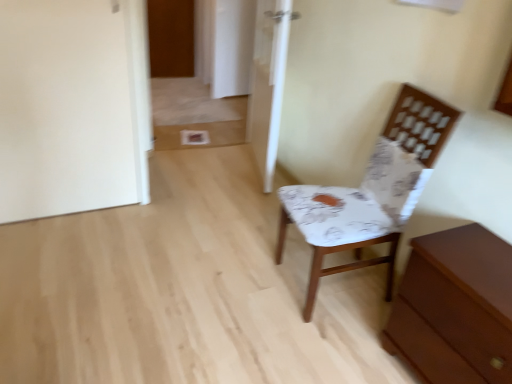
Question: Does white fabric chair at right touch brown wooden chest of drawers at lower right?

Choices:
 (A) no
 (B) yes

Answer: (A)

Question: Is white fabric chair at right smaller than brown wooden chest of drawers at lower right?

Choices:
 (A) yes
 (B) no

Answer: (B)

Question: From a real-world perspective, is white fabric chair at right positioned under brown wooden chest of drawers at lower right based on gravity?

Choices:
 (A) no
 (B) yes

Answer: (A)

Question: Does white fabric chair at right appear on the left side of brown wooden chest of drawers at lower right?

Choices:
 (A) no
 (B) yes

Answer: (B)

Question: From a real-world perspective, is white fabric chair at right on brown wooden chest of drawers at lower right?

Choices:
 (A) no
 (B) yes

Answer: (B)

Question: Considering the relative positions of white fabric chair at right and brown wooden chest of drawers at lower right in the image provided, is white fabric chair at right to the right of brown wooden chest of drawers at lower right from the viewer's perspective?

Choices:
 (A) yes
 (B) no

Answer: (B)

Question: Is wooden door at upper left, positioned as the second door in bottom-to-top order, surrounding white fabric chair at right?

Choices:
 (A) yes
 (B) no

Answer: (B)

Question: Is there a large distance between wooden door at upper left, which is counted as the 2th door, starting from the front, and white fabric chair at right?

Choices:
 (A) yes
 (B) no

Answer: (A)

Question: Is wooden door at upper left, which is counted as the 2th door, starting from the right, not within white fabric chair at right?

Choices:
 (A) yes
 (B) no

Answer: (A)

Question: From a real-world perspective, is wooden door at upper left, arranged as the first door when viewed from the back, below white fabric chair at right?

Choices:
 (A) no
 (B) yes

Answer: (B)

Question: Could you tell me if wooden door at upper left, which is counted as the 1th door, starting from the top, is turned towards white fabric chair at right?

Choices:
 (A) yes
 (B) no

Answer: (A)

Question: Is the position of wooden door at upper left, which is counted as the 1th door, starting from the top, more distant than that of white fabric chair at right?

Choices:
 (A) yes
 (B) no

Answer: (A)

Question: Considering the relative sizes of wooden door at upper left, which is counted as the 2th door, starting from the right, and white glossy door at center, arranged as the 1th door when ordered from the bottom, in the image provided, is wooden door at upper left, which is counted as the 2th door, starting from the right, shorter than white glossy door at center, arranged as the 1th door when ordered from the bottom,?

Choices:
 (A) yes
 (B) no

Answer: (A)